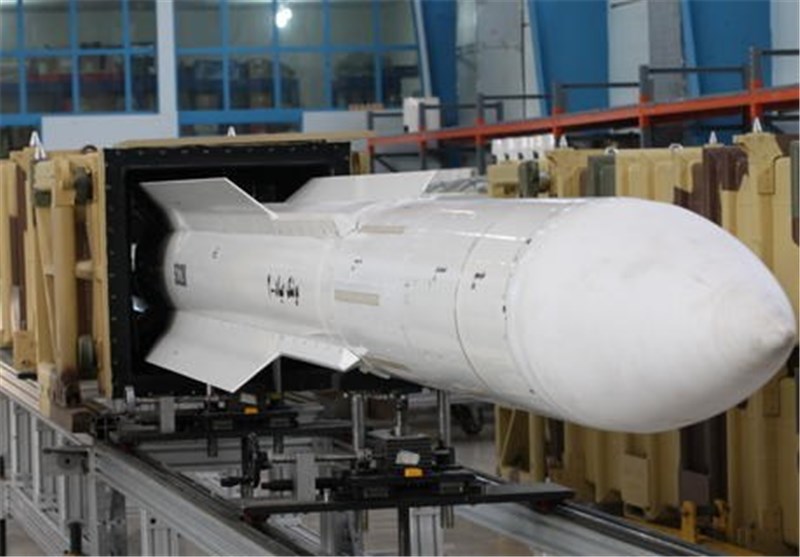
Where is `wall`? The image size is (800, 557). wall is located at coordinates (730, 39), (641, 35).